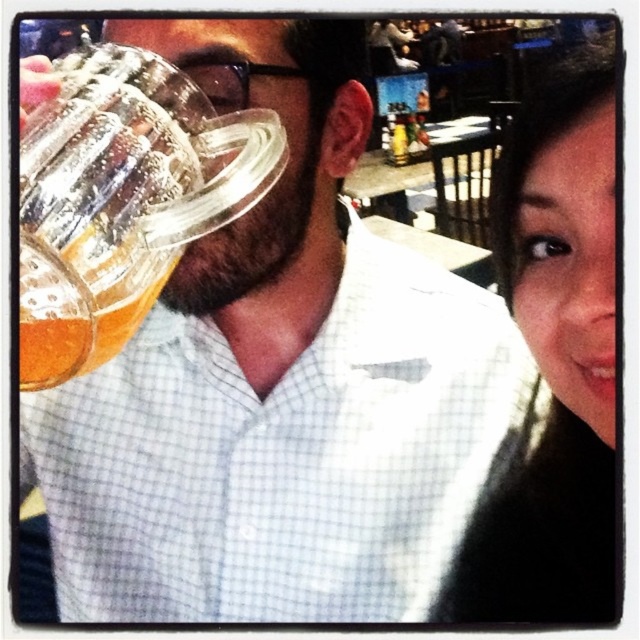
You are taking a selfie and want to ensure both the clear glass mug at left and the black hair at upper right are fully visible in the frame. Based on their positions, which object is closer to the camera?

The black hair at upper right is closer to the camera because the clear glass mug at left is behind it.

You are taking a selfie and notice two features in the photo. One is the black hair at upper right and the other is the man on the left holding a mug. Based on their positions, which one is closer to the center of the image?

The black hair at upper right is located at point (554, 364), while the man on the left is positioned on the left side of the frame. To determine which is closer to the center, we calculate the distance from each point to the center coordinates. The center of the image would be at point (320, 320). The distance from the black hair to the center is sqrt 0.569 minus 0.5 squared plus 0.866 minus 0.5 squared equals sqrt 0.004761 plus 0.133924 equals sqrt 0.138685 equals approximately 0.372. The man on the left,

You are a photographer trying to capture the scene in the image. You need to adjust your camera settings to focus on both the black hair at upper right and the clear glass mug at left. Considering their sizes, which object should you prioritize focusing on first?

The black hair at upper right is thinner than the clear glass mug at left, so you should prioritize focusing on the clear glass mug at left first since it is larger and might be easier to focus on.